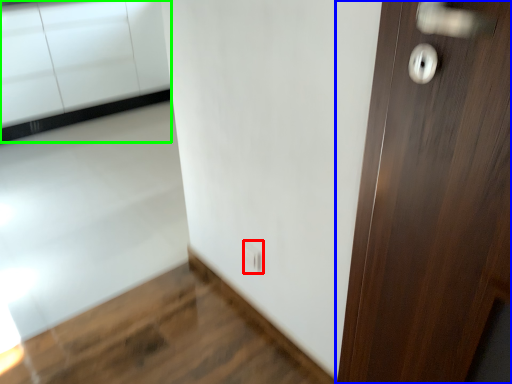
Question: Estimate the real-world distances between objects in this image. Which object is farther from electric outlet (highlighted by a red box), door (highlighted by a blue box) or cabinetry (highlighted by a green box)?

Choices:
 (A) door
 (B) cabinetry

Answer: (B)